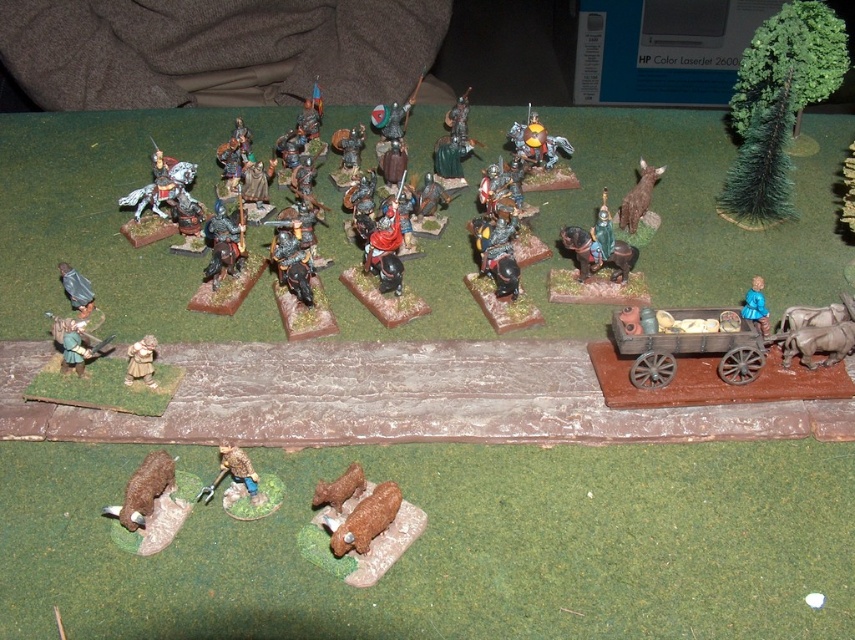
Measure the distance between wooden cart at lower right and camera.

wooden cart at lower right and camera are 4.92 feet apart.

Locate an element on the screen. wooden cart at lower right is located at coordinates (685, 349).

Measure the distance between point (140, 554) and camera.

Point (140, 554) is 1.31 meters away from camera.

Locate an element on the screen. The image size is (855, 640). brown matte cow at lower left is located at coordinates (152, 509).

Is point (175, 513) behind point (355, 477)?

Yes, it is.

You are a GUI agent. You are given a task and a screenshot of the screen. Output one action in this format:
    pyautogui.click(x=<x>, y=<y>)
    Task: Click on the brown matte cow at lower left
    
    Given the screenshot: What is the action you would take?
    pyautogui.click(x=152, y=509)

Does wooden cart at lower right appear on the right side of brown matte cow at lower center?

Yes, wooden cart at lower right is to the right of brown matte cow at lower center.

Who is taller, wooden cart at lower right or brown matte cow at lower center?

With more height is wooden cart at lower right.

Who is more distant from viewer, (628, 317) or (333, 554)?

Point (628, 317)

At what (x,y) coordinates should I click in order to perform the action: click on wooden cart at lower right. Please return your answer as a coordinate pair (x, y). The height and width of the screenshot is (640, 855). Looking at the image, I should click on (685, 349).